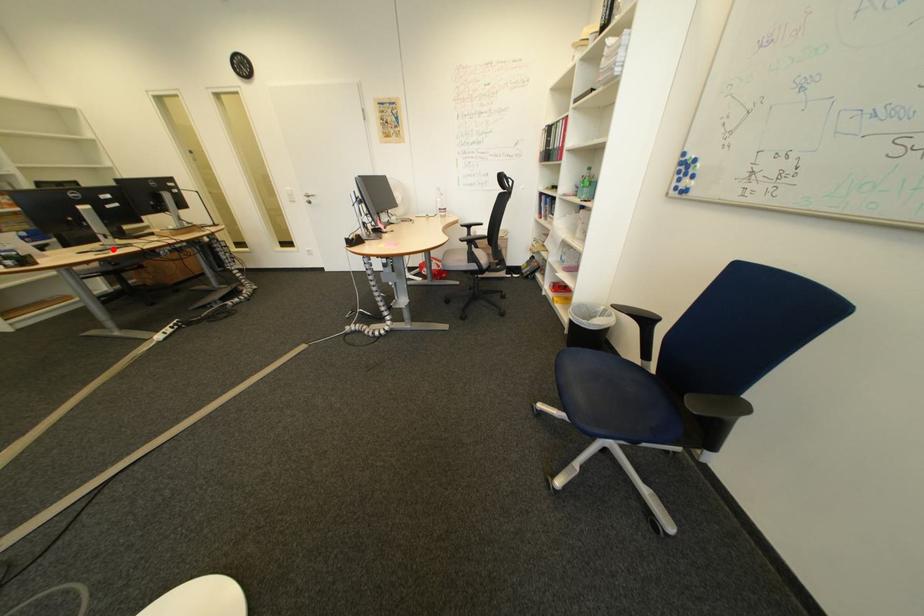
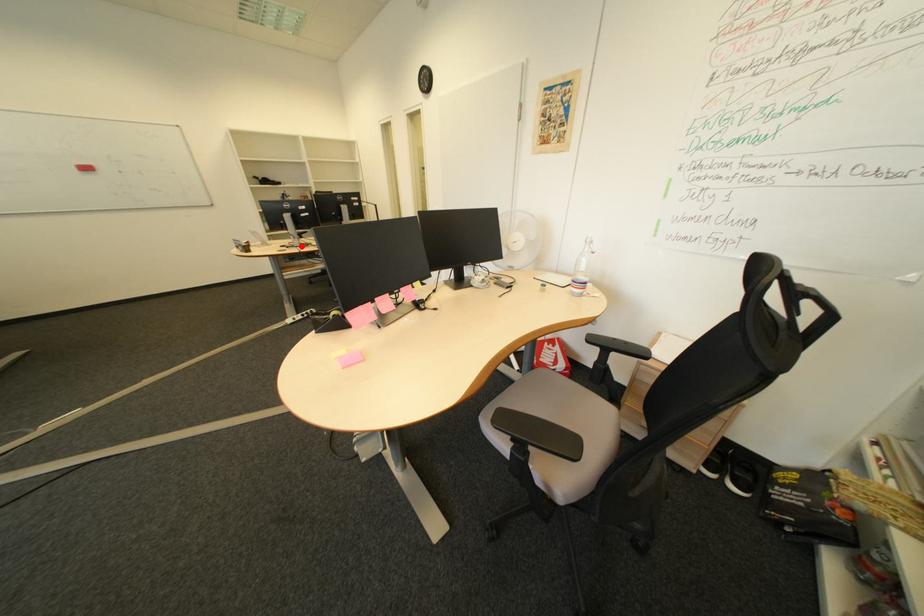
From the picture: I am providing you with two images of the same scene from different viewpoints. A red point is marked on the first image and another point is marked on the second image. Is the marked point in image1 the same physical position as the marked point in image2?

Yes